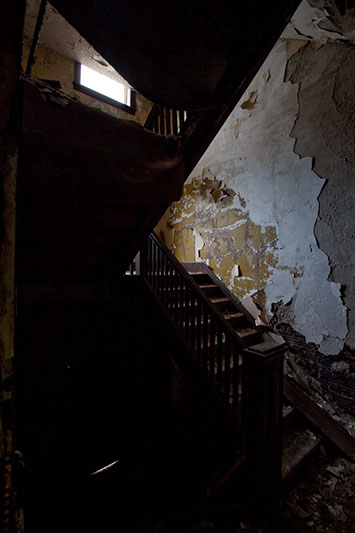
This screenshot has width=355, height=533. I want to click on window, so click(x=93, y=79).